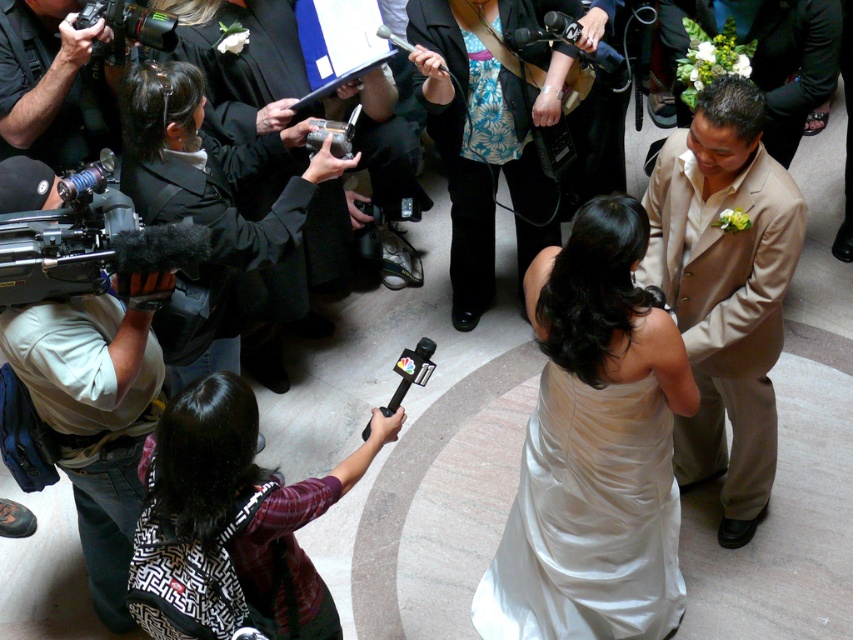
Is point (305, 573) farther from camera compared to point (323, 134)?

No, it is in front of (323, 134).

Which is below, plaid fabric shirt at lower left or silver metallic video camera at center?

Positioned lower is plaid fabric shirt at lower left.

At what (x,y) coordinates should I click in order to perform the action: click on plaid fabric shirt at lower left. Please return your answer as a coordinate pair (x, y). Looking at the image, I should click on (230, 524).

This screenshot has width=853, height=640. Describe the element at coordinates (230, 524) in the screenshot. I see `plaid fabric shirt at lower left` at that location.

Can you confirm if plaid fabric shirt at lower left is positioned below black matte video camera at left?

Yes.

Which is behind, point (198, 394) or point (41, 291)?

The point (41, 291) is more distant.

What are the coordinates of `plaid fabric shirt at lower left` in the screenshot? It's located at (230, 524).

Measure the distance between point (688, 468) and camera.

They are 11.39 feet apart.

Does tan satin suit at center appear on the left side of black plastic microphone at center?

Incorrect, tan satin suit at center is not on the left side of black plastic microphone at center.

Measure the distance between point (653, 204) and camera.

Point (653, 204) is 3.00 meters away from camera.

I want to click on tan satin suit at center, so click(724, 289).